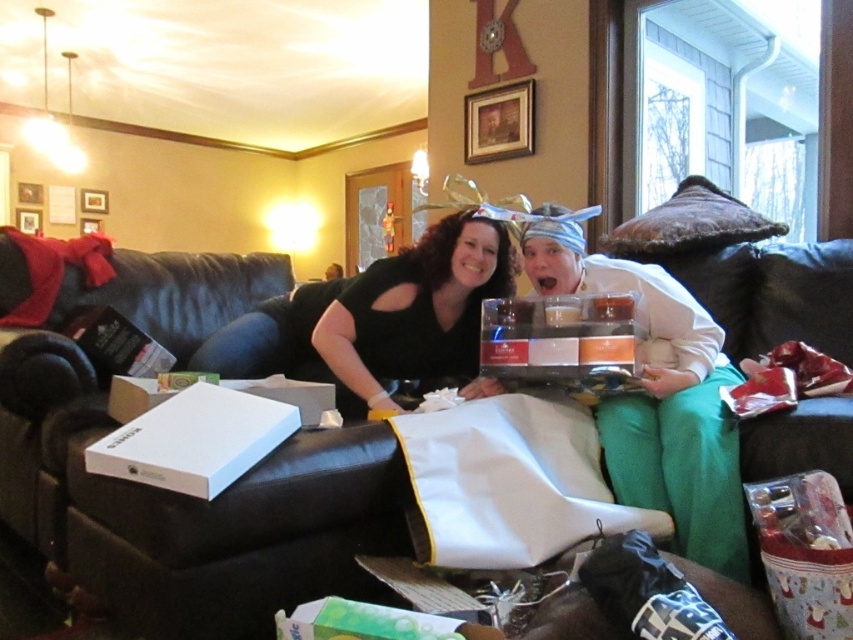
Is black leather couch at center wider than black matte shirt at center?

Correct, the width of black leather couch at center exceeds that of black matte shirt at center.

What do you see at coordinates (190, 509) in the screenshot? The width and height of the screenshot is (853, 640). I see `black leather couch at center` at bounding box center [190, 509].

Between point (228, 262) and point (456, 212), which one is positioned in front?

Positioned in front is point (456, 212).

Identify the location of black leather couch at center. coord(190,509).

Identify the location of black leather couch at center. (190, 509).

Does point (283, 508) lie in front of point (556, 253)?

That is True.

Is point (320, 556) positioned before point (740, 556)?

Yes, point (320, 556) is closer to viewer.

The width and height of the screenshot is (853, 640). What are the coordinates of `black leather couch at center` in the screenshot? It's located at (190, 509).

Can you confirm if matte white tray at center is taller than black matte shirt at center?

Correct, matte white tray at center is much taller as black matte shirt at center.

Consider the image. Between matte white tray at center and black matte shirt at center, which one is positioned lower?

matte white tray at center is lower down.

This screenshot has width=853, height=640. I want to click on matte white tray at center, so click(659, 400).